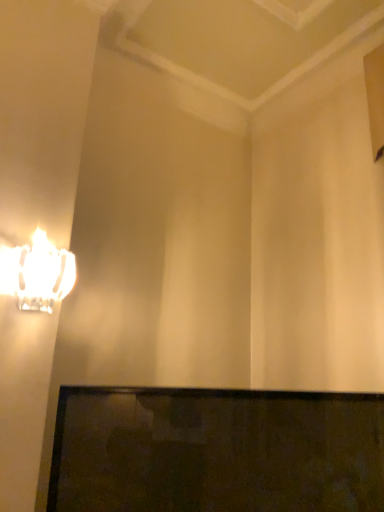
Describe the element at coordinates (37, 273) in the screenshot. I see `translucent glass lampshade at upper left` at that location.

At what (x,y) coordinates should I click in order to perform the action: click on translucent glass lampshade at upper left. Please return your answer as a coordinate pair (x, y). This screenshot has height=512, width=384. Looking at the image, I should click on (37, 273).

The image size is (384, 512). I want to click on translucent glass lampshade at upper left, so click(37, 273).